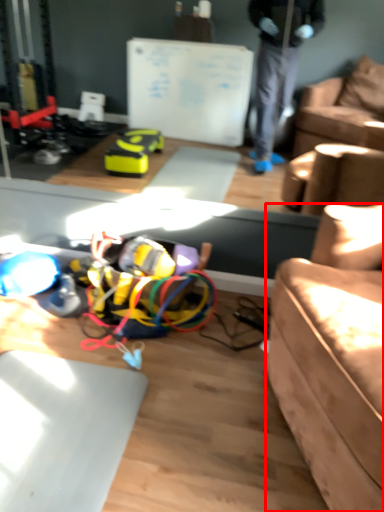
Question: From the image, what is the correct spatial relationship of studio couch (annotated by the red box) in relation to wire?

Choices:
 (A) left
 (B) right

Answer: (B)